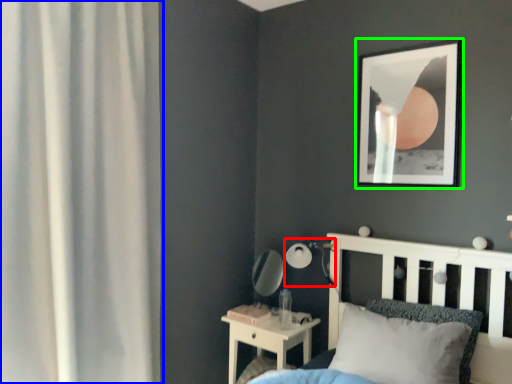
Question: Estimate the real-world distances between objects in this image. Which object is closer to table lamp (highlighted by a red box), curtain (highlighted by a blue box) or picture frame (highlighted by a green box)?

Choices:
 (A) curtain
 (B) picture frame

Answer: (B)